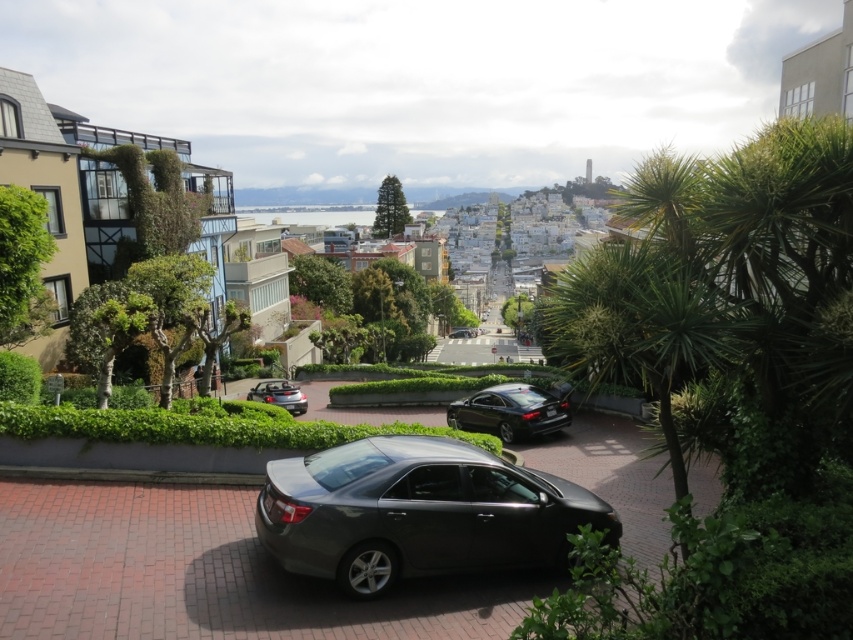
You are a delivery driver who needs to park your vehicle between the glossy black sedan at center and the shiny black sedan at center. Which side should you park on to ensure your vehicle doesn t hit the taller car?

The glossy black sedan at center is taller than the shiny black sedan at center, so you should park on the side of the shiny black sedan at center to avoid hitting the taller vehicle.